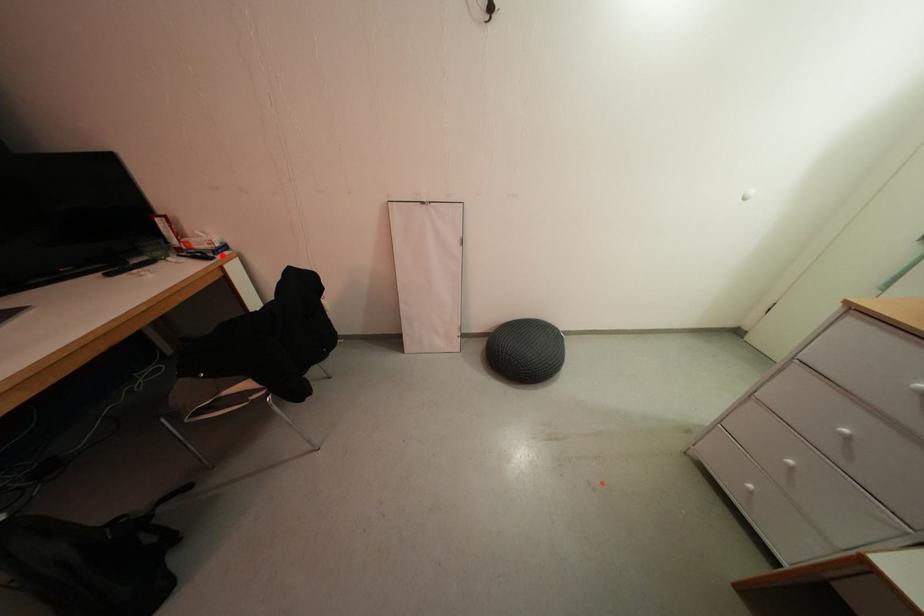
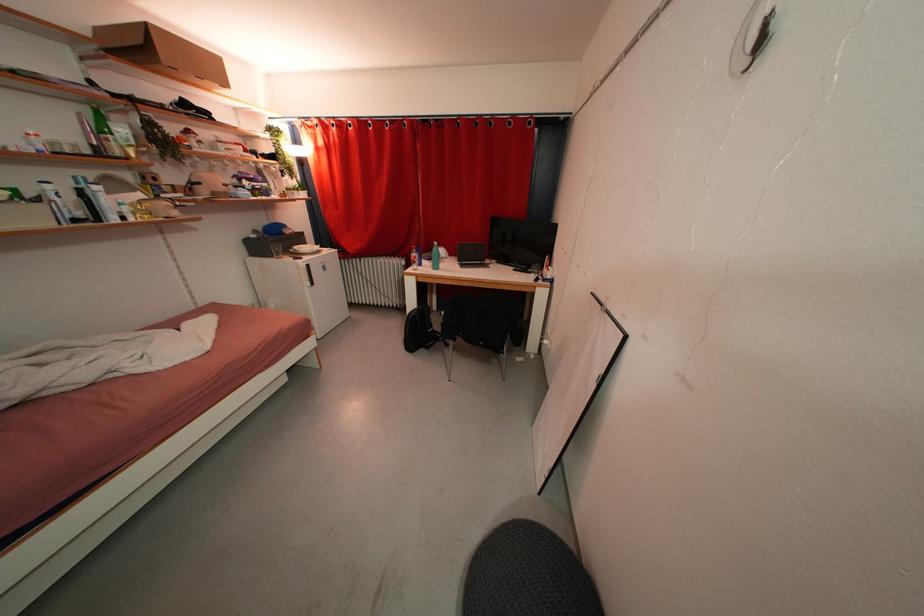
Find the pixel in the second image that matches the highlighted location in the first image.

(551, 284)